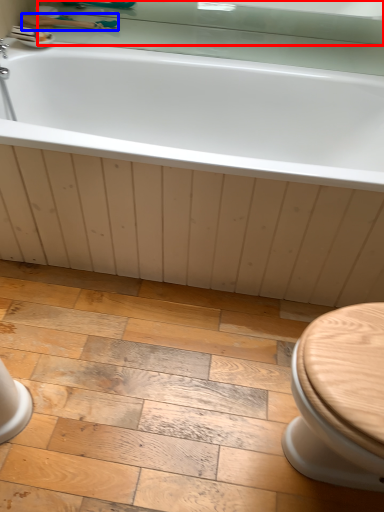
Question: Which object is further to the camera taking this photo, mirror (highlighted by a red box) or shower (highlighted by a blue box)?

Choices:
 (A) mirror
 (B) shower

Answer: (B)